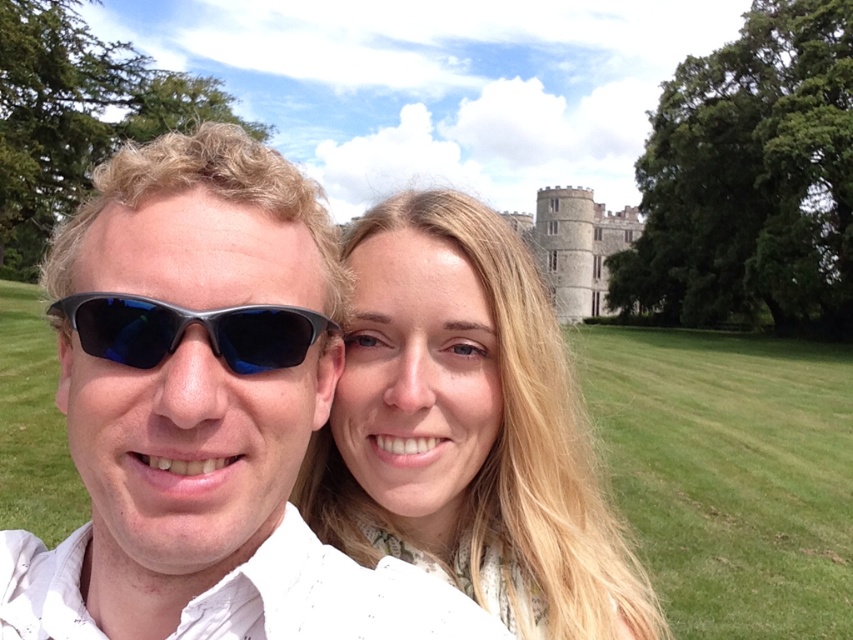
You are a photographer trying to capture a candid shot of the two people in the park. You notice the matte white sunglasses at center and the sunglasses at left. Which pair of sunglasses is positioned more to the left in the image?

The matte white sunglasses at center is positioned more to the left compared to the sunglasses at left.

You are a photographer trying to capture a photo of the stone medieval tower at center. There is a person wearing matte white sunglasses at center in the way. Can you shift your camera position to the right to get a clear view of the tower without the sunglasses blocking it?

The matte white sunglasses at center is to the left of the stone medieval tower at center, so shifting the camera to the right should allow you to avoid the sunglasses and capture the tower clearly.

You are a photographer trying to capture the perfect shot of the blonde hair at center. Given that your camera has a focal length of 50mm and you want to ensure the subject is centered in the frame, what adjustment should you make to the camera based on its current position?

Since the blonde hair at center is already positioned at point (x=468, y=429), which is close to the center coordinates, you can slightly adjust the camera to align the subject precisely at the center of the frame for optimal composition.